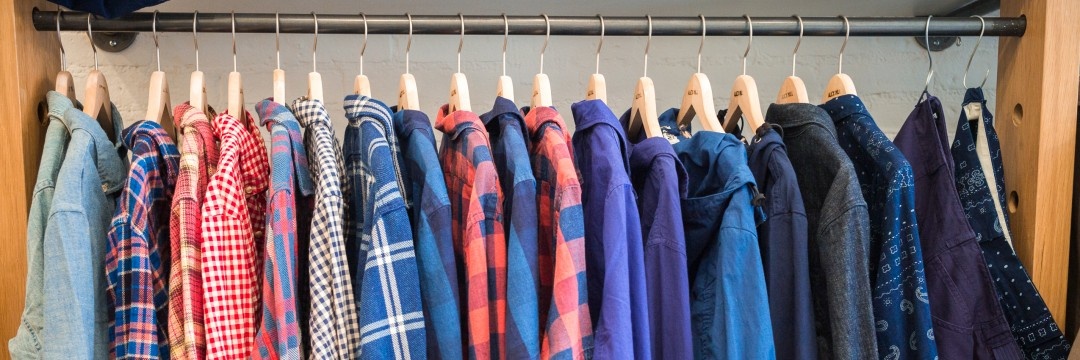
The width and height of the screenshot is (1080, 360). I want to click on left side of closet, so tap(12, 180).